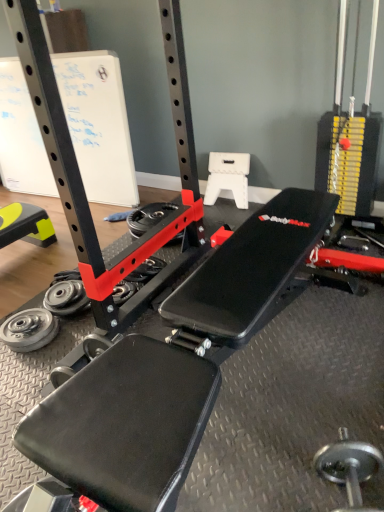
Describe the element at coordinates (148, 217) in the screenshot. I see `red plastic wheel at center, the third wheel viewed from the front` at that location.

This screenshot has width=384, height=512. What do you see at coordinates (25, 225) in the screenshot? I see `yellow rubber mat at lower left` at bounding box center [25, 225].

This screenshot has width=384, height=512. Describe the element at coordinates (98, 124) in the screenshot. I see `white paperboard at upper left` at that location.

At what (x,y) coordinates should I click in order to perform the action: click on red plastic wheel at center, the third wheel viewed from the front. Please return your answer as a coordinate pair (x, y). The height and width of the screenshot is (512, 384). Looking at the image, I should click on (148, 217).

Is white paperboard at upper left thinner than red plastic wheel at center, the third wheel viewed from the front?

Correct, the width of white paperboard at upper left is less than that of red plastic wheel at center, the third wheel viewed from the front.

Is white paperboard at upper left positioned beyond the bounds of red plastic wheel at center, which ranks as the 1th wheel in back-to-front order?

Yes, white paperboard at upper left is outside of red plastic wheel at center, which ranks as the 1th wheel in back-to-front order.

Does white paperboard at upper left turn towards red plastic wheel at center, the third wheel viewed from the front?

No, white paperboard at upper left does not turn towards red plastic wheel at center, the third wheel viewed from the front.

Based on the photo, can you tell me how much white paperboard at upper left and red plastic wheel at center, the third wheel viewed from the front, differ in facing direction?

The angle between the facing direction of white paperboard at upper left and the facing direction of red plastic wheel at center, the third wheel viewed from the front, is 1.9 degrees.

Relative to yellow rubber mat at lower left, is silver metallic dumbbell at lower right in front or behind?

silver metallic dumbbell at lower right is positioned closer to the viewer than yellow rubber mat at lower left.

Considering the positions of point (371, 456) and point (31, 239), is point (371, 456) closer or farther from the camera than point (31, 239)?

Point (371, 456).

Considering the relative sizes of silver metallic dumbbell at lower right and yellow rubber mat at lower left in the image provided, is silver metallic dumbbell at lower right smaller than yellow rubber mat at lower left?

Yes, silver metallic dumbbell at lower right is smaller than yellow rubber mat at lower left.

Does silver metallic dumbbell at lower right have a greater height compared to yellow rubber mat at lower left?

No, silver metallic dumbbell at lower right is not taller than yellow rubber mat at lower left.

Does silver metallic dumbbell at lower right come behind silver metallic weight plate at lower left, which appears as the 1th wheel when viewed from the front?

No.

Considering the sizes of objects silver metallic dumbbell at lower right and silver metallic weight plate at lower left, which appears as the 1th wheel when viewed from the front, in the image provided, who is shorter, silver metallic dumbbell at lower right or silver metallic weight plate at lower left, which appears as the 1th wheel when viewed from the front,?

With less height is silver metallic weight plate at lower left, which appears as the 1th wheel when viewed from the front.

Is silver metallic dumbbell at lower right positioned with its back to silver metallic weight plate at lower left, marked as the 1th wheel in a left-to-right arrangement?

silver metallic dumbbell at lower right is not turned away from silver metallic weight plate at lower left, marked as the 1th wheel in a left-to-right arrangement.

Is the surface of silver metallic dumbbell at lower right in direct contact with silver metallic weight plate at lower left, acting as the third wheel starting from the top?

They are not placed beside each other.

Is red plastic wheel at center, which ranks as the 1th wheel in back-to-front order, to the left of silver metallic dumbbell at lower right from the viewer's perspective?

Correct, you'll find red plastic wheel at center, which ranks as the 1th wheel in back-to-front order, to the left of silver metallic dumbbell at lower right.

Looking at this image, considering the sizes of objects red plastic wheel at center, the third wheel viewed from the front, and silver metallic dumbbell at lower right in the image provided, who is thinner, red plastic wheel at center, the third wheel viewed from the front, or silver metallic dumbbell at lower right?

With smaller width is silver metallic dumbbell at lower right.

Considering the sizes of objects red plastic wheel at center, the third wheel viewed from the front, and silver metallic dumbbell at lower right in the image provided, who is shorter, red plastic wheel at center, the third wheel viewed from the front, or silver metallic dumbbell at lower right?

red plastic wheel at center, the third wheel viewed from the front.

In the image, is red plastic wheel at center, the third wheel viewed from the front, positioned in front of or behind silver metallic dumbbell at lower right?

Visually, red plastic wheel at center, the third wheel viewed from the front, is located behind silver metallic dumbbell at lower right.

Are red plastic wheel at center, the third wheel viewed from the front, and silver metallic weight at lower left, the 2th wheel from the right, beside each other?

There is a gap between red plastic wheel at center, the third wheel viewed from the front, and silver metallic weight at lower left, the 2th wheel from the right.

Does red plastic wheel at center, the third wheel viewed from the front, have a greater width compared to silver metallic weight at lower left, which ranks as the 2th wheel in back-to-front order?

Correct, the width of red plastic wheel at center, the third wheel viewed from the front, exceeds that of silver metallic weight at lower left, which ranks as the 2th wheel in back-to-front order.

Is red plastic wheel at center, placed as the 3th wheel when sorted from left to right, aimed at silver metallic weight at lower left, which is the 2th wheel from top to bottom?

Yes, red plastic wheel at center, placed as the 3th wheel when sorted from left to right, is facing silver metallic weight at lower left, which is the 2th wheel from top to bottom.

In terms of size, does red plastic wheel at center, the first wheel when ordered from top to bottom, appear bigger or smaller than silver metallic weight at lower left, which is the 2th wheel from top to bottom?

In the image, red plastic wheel at center, the first wheel when ordered from top to bottom, appears to be larger than silver metallic weight at lower left, which is the 2th wheel from top to bottom.

Could you tell me if red plastic wheel at center, which ranks as the 1th wheel in back-to-front order, is facing yellow rubber mat at lower left?

No.

Consider the image. Does red plastic wheel at center, which ranks as the 1th wheel in back-to-front order, touch yellow rubber mat at lower left?

No, red plastic wheel at center, which ranks as the 1th wheel in back-to-front order, is not touching yellow rubber mat at lower left.

Which is further, (154, 210) or (10, 240)?

The point (154, 210) is more distant.

Which object is closer to the camera taking this photo, red plastic wheel at center, the 3th wheel when ordered from bottom to top, or yellow rubber mat at lower left?

yellow rubber mat at lower left is closer to the camera.

Between yellow rubber mat at lower left and silver metallic dumbbell at lower right, which one has larger width?

With larger width is yellow rubber mat at lower left.

Does point (28, 215) appear closer or farther from the camera than point (332, 467)?

Point (28, 215) appears to be farther away from the viewer than point (332, 467).

From the image's perspective, is yellow rubber mat at lower left positioned above or below silver metallic dumbbell at lower right?

Based on their image positions, yellow rubber mat at lower left is located above silver metallic dumbbell at lower right.

Considering the sizes of objects yellow rubber mat at lower left and silver metallic dumbbell at lower right in the image provided, who is taller, yellow rubber mat at lower left or silver metallic dumbbell at lower right?

yellow rubber mat at lower left.

Which wheel is the 1st one when counting from the front of the white paperboard at upper left? Please provide its 2D coordinates.

[(148, 217)]

Find the location of a particular element. The image size is (384, 512). bench located above the silver metallic dumbbell at lower right (from the image's perspective) is located at coordinates (25, 225).

When comparing their distances from white paperboard at upper left, does red plastic wheel at center, the 3th wheel when ordered from bottom to top, or silver metallic dumbbell at lower right seem further?

Among the two, silver metallic dumbbell at lower right is located further to white paperboard at upper left.

Which object lies nearer to the anchor point silver metallic weight plate at lower left, acting as the third wheel starting from the top, silver metallic dumbbell at lower right or silver metallic weight at lower left, the 2th wheel from the right?

silver metallic weight at lower left, the 2th wheel from the right.

Looking at the image, which one is located closer to silver metallic dumbbell at lower right, silver metallic weight plate at lower left, the third wheel in the right-to-left sequence, or yellow rubber mat at lower left?

silver metallic weight plate at lower left, the third wheel in the right-to-left sequence, is positioned closer to the anchor silver metallic dumbbell at lower right.

Which object lies nearer to the anchor point red plastic wheel at center, which ranks as the 1th wheel in back-to-front order, silver metallic dumbbell at lower right or silver metallic weight at lower left, acting as the second wheel starting from the bottom?

Based on the image, silver metallic weight at lower left, acting as the second wheel starting from the bottom, appears to be nearer to red plastic wheel at center, which ranks as the 1th wheel in back-to-front order.

From the image, which object appears to be farther from silver metallic dumbbell at lower right, yellow rubber mat at lower left or red plastic wheel at center, positioned as the 1th wheel in right-to-left order?

Among the two, yellow rubber mat at lower left is located further to silver metallic dumbbell at lower right.

Based on their spatial positions, is yellow rubber mat at lower left or silver metallic weight at lower left, which ranks as the 2th wheel in back-to-front order, closer to silver metallic weight plate at lower left, placed as the third wheel when sorted from back to front?

silver metallic weight at lower left, which ranks as the 2th wheel in back-to-front order, lies closer to silver metallic weight plate at lower left, placed as the third wheel when sorted from back to front, than the other object.

From the image, which object appears to be farther from silver metallic dumbbell at lower right, red plastic wheel at center, the third wheel viewed from the front, or yellow rubber mat at lower left?

yellow rubber mat at lower left lies further to silver metallic dumbbell at lower right than the other object.

Based on their spatial positions, is silver metallic weight plate at lower left, acting as the third wheel starting from the top, or silver metallic dumbbell at lower right closer to red plastic wheel at center, the first wheel when ordered from top to bottom?

The object closer to red plastic wheel at center, the first wheel when ordered from top to bottom, is silver metallic weight plate at lower left, acting as the third wheel starting from the top.

The width and height of the screenshot is (384, 512). I want to click on bench located between silver metallic dumbbell at lower right and red plastic wheel at center, which ranks as the 1th wheel in back-to-front order, in the depth direction, so click(25, 225).

You are a GUI agent. You are given a task and a screenshot of the screen. Output one action in this format:
    pyautogui.click(x=<x>, y=<y>)
    Task: Click on the wheel between white paperboard at upper left and yellow rubber mat at lower left in the vertical direction
    This screenshot has width=384, height=512.
    Given the screenshot: What is the action you would take?
    pyautogui.click(x=148, y=217)

What are the coordinates of `wheel between white paperboard at upper left and silver metallic weight at lower left, marked as the 2th wheel in a front-to-back arrangement, from top to bottom` in the screenshot? It's located at (148, 217).

Locate an element on the screen. This screenshot has height=512, width=384. wheel between silver metallic weight plate at lower left, the 1th wheel in the bottom-to-top sequence, and red plastic wheel at center, the third wheel viewed from the front, in the front-back direction is located at coordinates (66, 297).